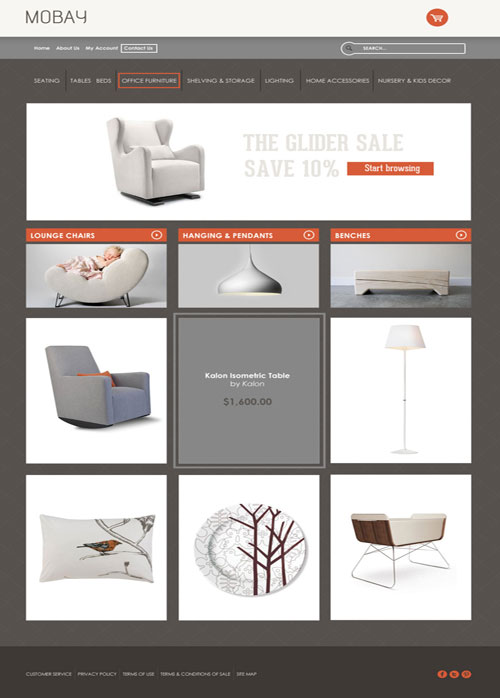
You are a GUI agent. You are given a task and a screenshot of the screen. Output one action in this format:
    pyautogui.click(x=<x>, y=<y>)
    Task: Click on the throw pillow that has a bird on it
    This screenshot has height=698, width=500.
    Given the screenshot: What is the action you would take?
    pyautogui.click(x=106, y=560)